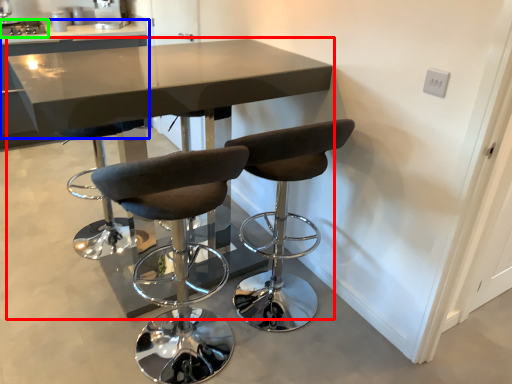
Question: Which is nearer to the table (highlighted by a red box)? table (highlighted by a blue box) or appliance (highlighted by a green box).

Choices:
 (A) table
 (B) appliance

Answer: (A)